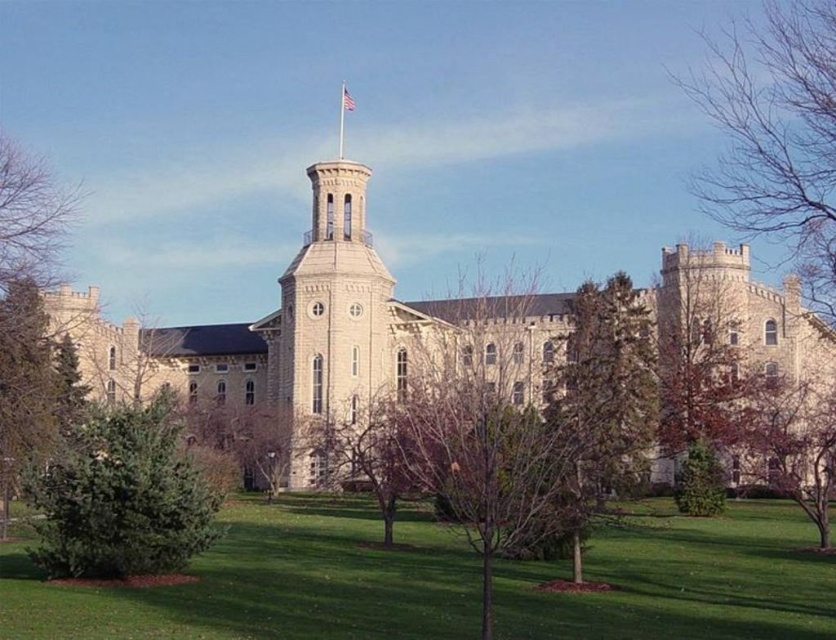
Looking at this image, you are a landscape architect designing a garden path that needs to pass between the bare branches at center and the green textured bush at lower left. Given the width of the path must be at least 1 meter, can the path be placed between them?

The bare branches at center is narrower than the green textured bush at lower left, but the exact widths are not provided. Therefore, it is uncertain if the path can be placed between them without more specific measurements.